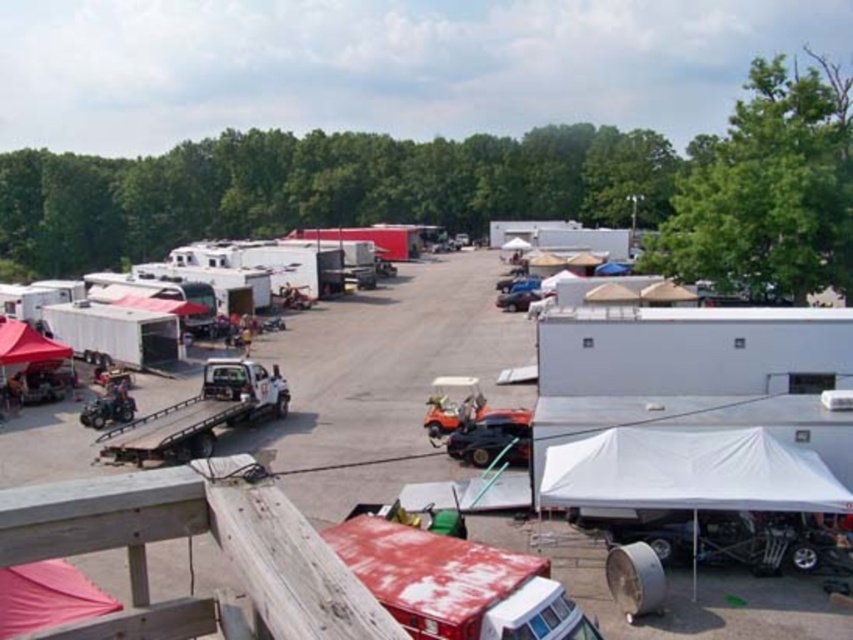
Question: Which point is farther from the camera taking this photo?

Choices:
 (A) (743, 481)
 (B) (286, 419)

Answer: (B)

Question: Can you confirm if white matte trailer at center is smaller than white fabric tent at lower right?

Choices:
 (A) yes
 (B) no

Answer: (B)

Question: Is white matte trailer at center further to camera compared to white fabric tent at lower right?

Choices:
 (A) yes
 (B) no

Answer: (B)

Question: Can you confirm if white matte trailer at center is wider than white fabric tent at lower right?

Choices:
 (A) yes
 (B) no

Answer: (A)

Question: Which object is closer to the camera taking this photo?

Choices:
 (A) white matte trailer at center
 (B) white fabric tent at lower right

Answer: (A)

Question: Which point appears closest to the camera in this image?

Choices:
 (A) (701, 461)
 (B) (430, 369)

Answer: (A)